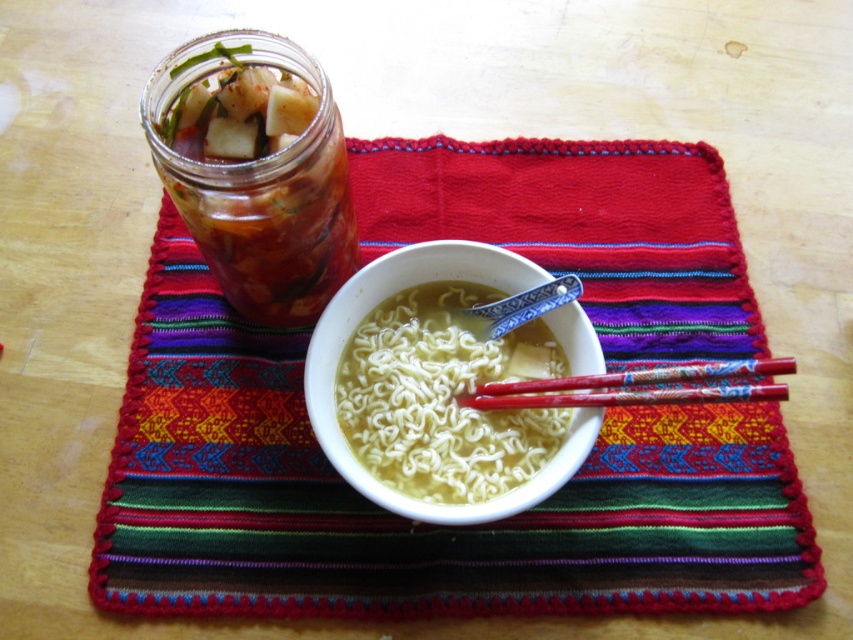
Question: Where is multicolored woven placemat at center located in relation to red lacquered chopsticks at center in the image?

Choices:
 (A) left
 (B) right

Answer: (A)

Question: Which of the following is the farthest from the observer?

Choices:
 (A) white ceramic bowl at center
 (B) translucent glass jar at upper left
 (C) multicolored woven placemat at center

Answer: (C)

Question: Considering the relative positions of multicolored woven placemat at center and red lacquered chopsticks at center in the image provided, where is multicolored woven placemat at center located with respect to red lacquered chopsticks at center?

Choices:
 (A) left
 (B) right

Answer: (A)

Question: Which of the following is the farthest from the observer?

Choices:
 (A) (334, 460)
 (B) (704, 388)
 (C) (248, 80)

Answer: (C)

Question: Does translucent glass jar at upper left lie in front of red lacquered chopsticks at center?

Choices:
 (A) no
 (B) yes

Answer: (A)

Question: Considering the real-world distances, which object is farthest from the white ceramic bowl at center?

Choices:
 (A) multicolored woven placemat at center
 (B) translucent glass jar at upper left
 (C) red lacquered chopsticks at center

Answer: (B)